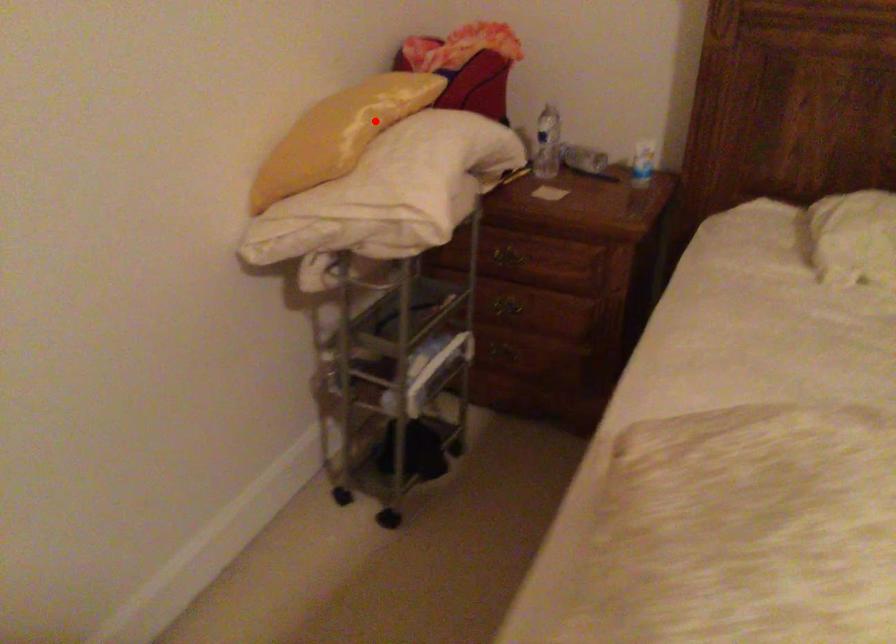
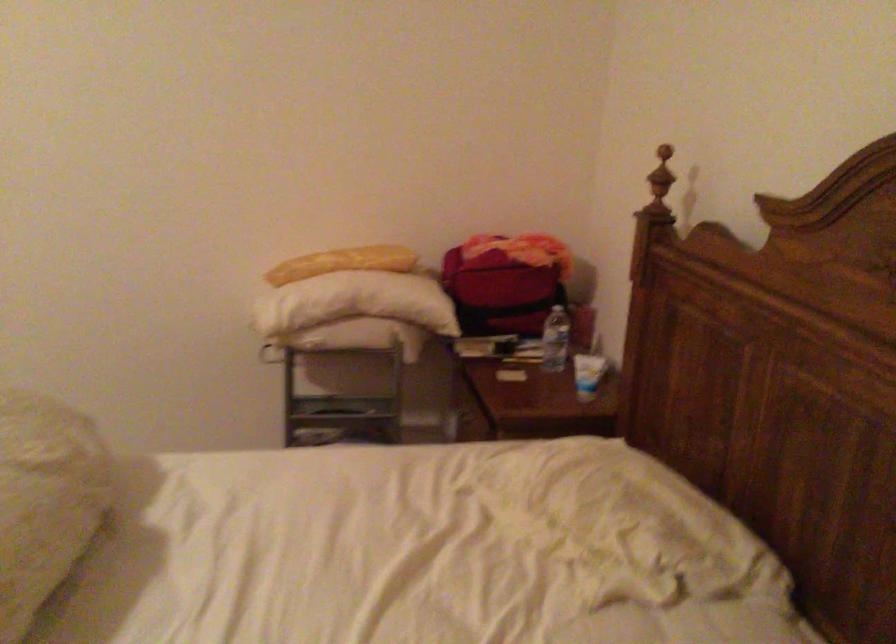
Find the pixel in the second image that matches the highlighted location in the first image.

(342, 263)